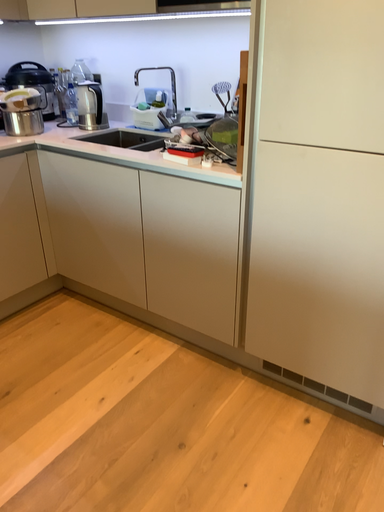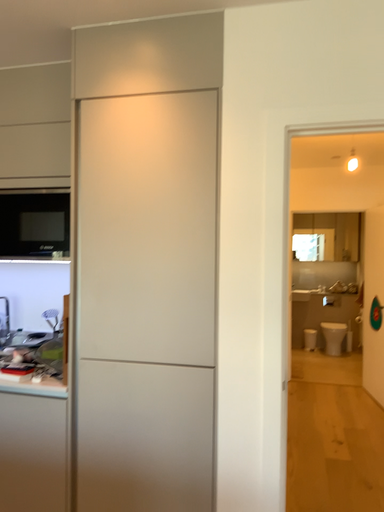
Question: How did the camera likely rotate when shooting the video?

Choices:
 (A) rotated downward
 (B) rotated upward

Answer: (B)